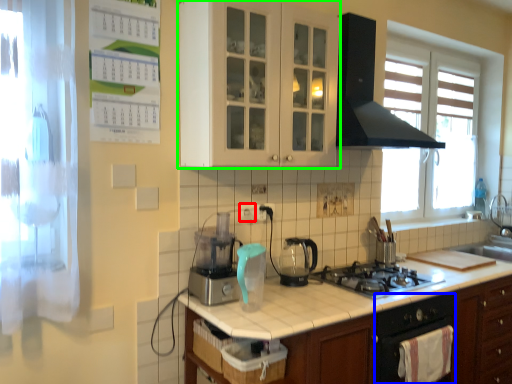
Question: Which is farther away from electric outlet (highlighted by a red box)? oven (highlighted by a blue box) or cabinetry (highlighted by a green box)?

Choices:
 (A) oven
 (B) cabinetry

Answer: (A)